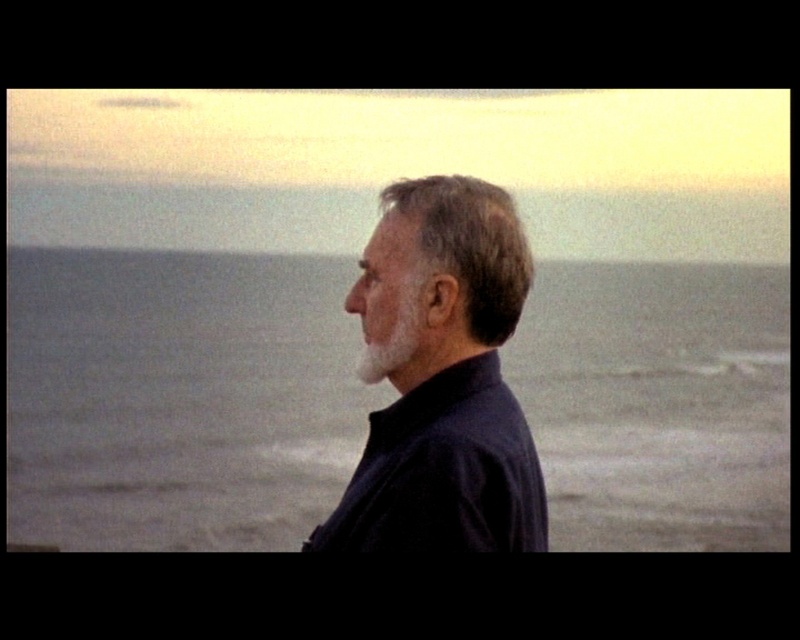
Question: Which point appears farthest from the camera in this image?

Choices:
 (A) (462, 195)
 (B) (417, 470)
 (C) (660, 394)
 (D) (368, 346)

Answer: (C)

Question: Which of these objects is positioned farthest from the white matte beard at center?

Choices:
 (A) dark brown textured hair at center
 (B) gray matte water at center
 (C) dark blue shirt at center

Answer: (B)

Question: Is gray matte water at center bigger than white matte beard at center?

Choices:
 (A) yes
 (B) no

Answer: (A)

Question: Which of the following is the farthest from the observer?

Choices:
 (A) (676, 426)
 (B) (413, 342)

Answer: (A)

Question: Observing the image, what is the correct spatial positioning of gray matte water at center in reference to dark blue shirt at center?

Choices:
 (A) below
 (B) above

Answer: (B)

Question: Is dark brown textured hair at center above white matte beard at center?

Choices:
 (A) yes
 (B) no

Answer: (A)